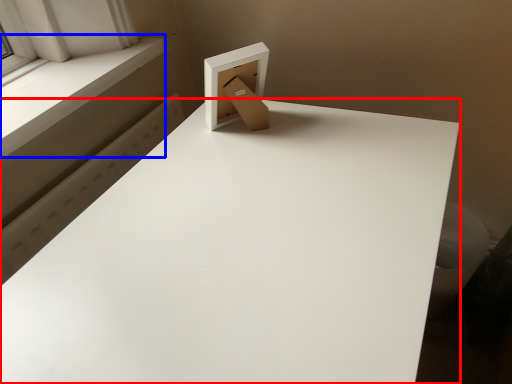
Question: Which of the following is the closest to the observer, table (highlighted by a red box) or window sill (highlighted by a blue box)?

Choices:
 (A) table
 (B) window sill

Answer: (A)